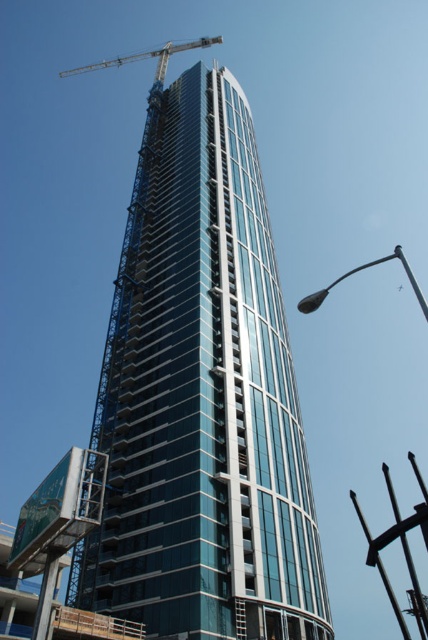
Which is in front, point (243, 298) or point (112, 61)?

Point (243, 298)

Which is behind, point (213, 412) or point (166, 52)?

Positioned behind is point (166, 52).

Find the location of a particular element. This screenshot has height=640, width=428. glassy steel tower at center is located at coordinates (202, 396).